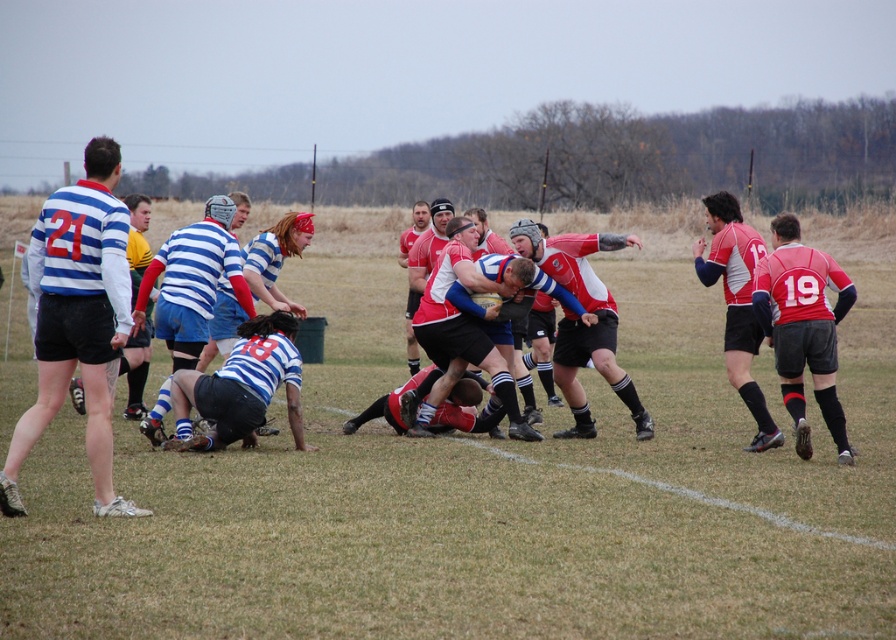
Can you confirm if striped jersey shorts at left is shorter than matte red rugby jersey at right?

No.

Find the location of a particular element. The width and height of the screenshot is (896, 640). striped jersey shorts at left is located at coordinates (78, 320).